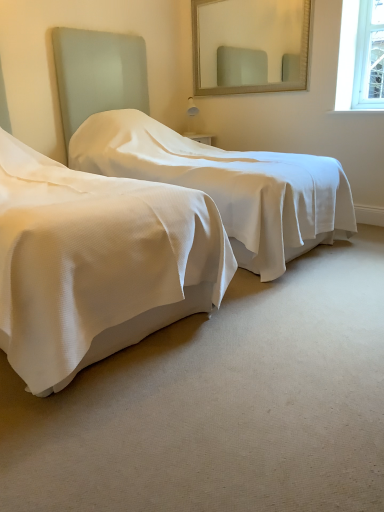
Question: Which direction should I rotate to face white textured bed at center, which is the 2th bed from right to left, — up or down?

Choices:
 (A) up
 (B) down

Answer: (A)

Question: Are white textured bed at center, placed as the first bed when sorted from left to right, and white textured bed at left, which is the 2th bed in left-to-right order, far apart?

Choices:
 (A) yes
 (B) no

Answer: (A)

Question: Is white textured bed at center, placed as the first bed when sorted from left to right, completely or partially outside of white textured bed at left, the first bed in the right-to-left sequence?

Choices:
 (A) yes
 (B) no

Answer: (A)

Question: Considering the relative sizes of white textured bed at center, placed as the first bed when sorted from left to right, and white textured bed at left, which is the 2th bed in left-to-right order, in the image provided, is white textured bed at center, placed as the first bed when sorted from left to right, smaller than white textured bed at left, which is the 2th bed in left-to-right order,?

Choices:
 (A) no
 (B) yes

Answer: (A)

Question: Is the depth of white textured bed at center, which is the 2th bed from right to left, less than that of white textured bed at left, the first bed in the right-to-left sequence?

Choices:
 (A) no
 (B) yes

Answer: (B)

Question: Does white textured bed at center, placed as the first bed when sorted from left to right, turn towards white textured bed at left, the first bed in the right-to-left sequence?

Choices:
 (A) yes
 (B) no

Answer: (B)

Question: Is white textured bed at center, which is the 2th bed from right to left, positioned with its back to white textured bed at left, which is the 2th bed in left-to-right order?

Choices:
 (A) yes
 (B) no

Answer: (B)

Question: Is white textured bed at left, the first bed in the right-to-left sequence, bigger than matte glass mirror at upper center?

Choices:
 (A) no
 (B) yes

Answer: (B)

Question: Is matte glass mirror at upper center at the back of white textured bed at left, the first bed in the right-to-left sequence?

Choices:
 (A) no
 (B) yes

Answer: (A)

Question: From a real-world perspective, is white textured bed at left, which is the 2th bed in left-to-right order, on top of matte glass mirror at upper center?

Choices:
 (A) yes
 (B) no

Answer: (B)

Question: Is the position of white textured bed at left, the first bed in the right-to-left sequence, less distant than that of matte glass mirror at upper center?

Choices:
 (A) yes
 (B) no

Answer: (A)

Question: Is white textured bed at left, the first bed in the right-to-left sequence, shorter than matte glass mirror at upper center?

Choices:
 (A) yes
 (B) no

Answer: (B)

Question: From the image's perspective, is white textured bed at left, which is the 2th bed in left-to-right order, on top of matte glass mirror at upper center?

Choices:
 (A) yes
 (B) no

Answer: (B)

Question: From the image's perspective, is matte glass mirror at upper center on white textured bed at left, which is the 2th bed in left-to-right order?

Choices:
 (A) no
 (B) yes

Answer: (B)